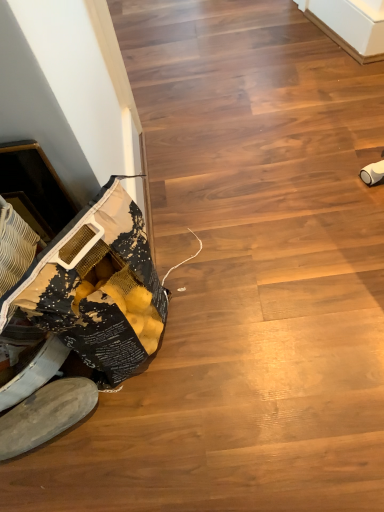
The width and height of the screenshot is (384, 512). Identify the location of white suede shoe at lower left. (46, 414).

What is the approximate height of white suede shoe at lower left?

white suede shoe at lower left is 3.65 inches tall.

This screenshot has height=512, width=384. Describe the element at coordinates (46, 414) in the screenshot. I see `white suede shoe at lower left` at that location.

Consider the image. Measure the distance between point (334, 250) and camera.

Point (334, 250) and camera are 1.17 meters apart.

In order to face wooden floor at lower left, should I rotate leftwards or rightwards?

Rotate right and turn 4.674 degrees.

At what (x,y) coordinates should I click in order to perform the action: click on wooden floor at lower left. Please return your answer as a coordinate pair (x, y). Looking at the image, I should click on (254, 267).

Image resolution: width=384 pixels, height=512 pixels. What do you see at coordinates (254, 267) in the screenshot?
I see `wooden floor at lower left` at bounding box center [254, 267].

Image resolution: width=384 pixels, height=512 pixels. In order to click on white suede shoe at lower left in this screenshot , I will do `click(46, 414)`.

Which is more to the left, white suede shoe at lower left or wooden floor at lower left?

white suede shoe at lower left is more to the left.

Which object is closer to the camera, white suede shoe at lower left or wooden floor at lower left?

wooden floor at lower left.

Does point (17, 438) appear closer or farther from the camera than point (327, 52)?

Point (17, 438) is closer to the camera than point (327, 52).

From the image's perspective, which one is positioned lower, white suede shoe at lower left or wooden floor at lower left?

white suede shoe at lower left appears lower in the image.

From a real-world perspective, relative to wooden floor at lower left, is white suede shoe at lower left vertically above or below?

white suede shoe at lower left is situated higher than wooden floor at lower left in the real world.

Which object is wider, white suede shoe at lower left or wooden floor at lower left?

Wider between the two is wooden floor at lower left.

Is white suede shoe at lower left taller or shorter than wooden floor at lower left?

Clearly, white suede shoe at lower left is taller compared to wooden floor at lower left.

Who is bigger, white suede shoe at lower left or wooden floor at lower left?

With larger size is wooden floor at lower left.

Is white suede shoe at lower left surrounding wooden floor at lower left?

No, white suede shoe at lower left does not contain wooden floor at lower left.

Is white suede shoe at lower left beside wooden floor at lower left?

No.

Consider the image. Is white suede shoe at lower left turned away from wooden floor at lower left?

That's not correct — white suede shoe at lower left is not looking away from wooden floor at lower left.

How many degrees apart are the facing directions of white suede shoe at lower left and wooden floor at lower left?

white suede shoe at lower left and wooden floor at lower left are facing 162 degrees away from each other.

This screenshot has width=384, height=512. I want to click on stairwell located underneath the white suede shoe at lower left (from a real-world perspective), so [x=254, y=267].

Between wooden floor at lower left and white suede shoe at lower left, which one appears on the left side from the viewer's perspective?

Positioned to the left is white suede shoe at lower left.

Is the depth of wooden floor at lower left greater than that of white suede shoe at lower left?

No, wooden floor at lower left is closer to the viewer.

Is point (165, 130) behind point (47, 431)?

That is True.

From the image's perspective, which one is positioned higher, wooden floor at lower left or white suede shoe at lower left?

From the image's view, wooden floor at lower left is above.

From a real-world perspective, between wooden floor at lower left and white suede shoe at lower left, who is vertically higher?

white suede shoe at lower left.

Does wooden floor at lower left have a lesser width compared to white suede shoe at lower left?

No.

Between wooden floor at lower left and white suede shoe at lower left, which one has more height?

white suede shoe at lower left is taller.

Is wooden floor at lower left smaller than white suede shoe at lower left?

No.

Is wooden floor at lower left inside or outside of white suede shoe at lower left?

wooden floor at lower left lies outside white suede shoe at lower left.

Is wooden floor at lower left with white suede shoe at lower left?

No, wooden floor at lower left is not making contact with white suede shoe at lower left.

Is wooden floor at lower left oriented towards white suede shoe at lower left?

No.

How distant is wooden floor at lower left from white suede shoe at lower left?

wooden floor at lower left is 19.29 inches from white suede shoe at lower left.

Identify the location of footwear lying on the left of wooden floor at lower left. The image size is (384, 512). (46, 414).

Where is `footwear that is on the left side of wooden floor at lower left`? footwear that is on the left side of wooden floor at lower left is located at coordinates (46, 414).

Locate an element on the screen. The height and width of the screenshot is (512, 384). stairwell above the white suede shoe at lower left (from the image's perspective) is located at coordinates (254, 267).